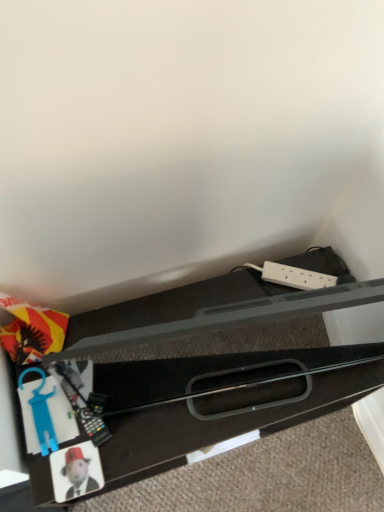
At what (x,y) coordinates should I click in order to perform the action: click on free location to the right of blue plastic toy at lower left, marked as the first toy in a top-to-bottom arrangement. Please return your answer as a coordinate pair (x, y). This screenshot has width=384, height=512. Looking at the image, I should click on click(127, 441).